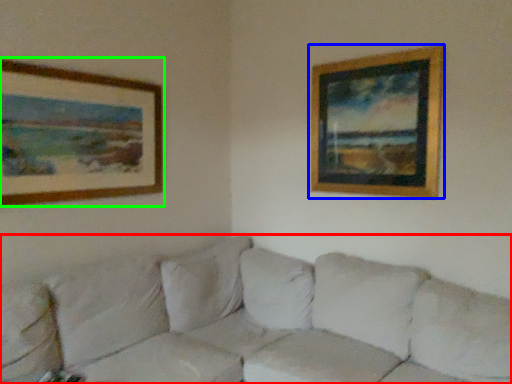
Question: Based on their relative distances, which object is farther from studio couch (highlighted by a red box)? Choose from picture frame (highlighted by a blue box) and picture frame (highlighted by a green box).

Choices:
 (A) picture frame
 (B) picture frame

Answer: (A)